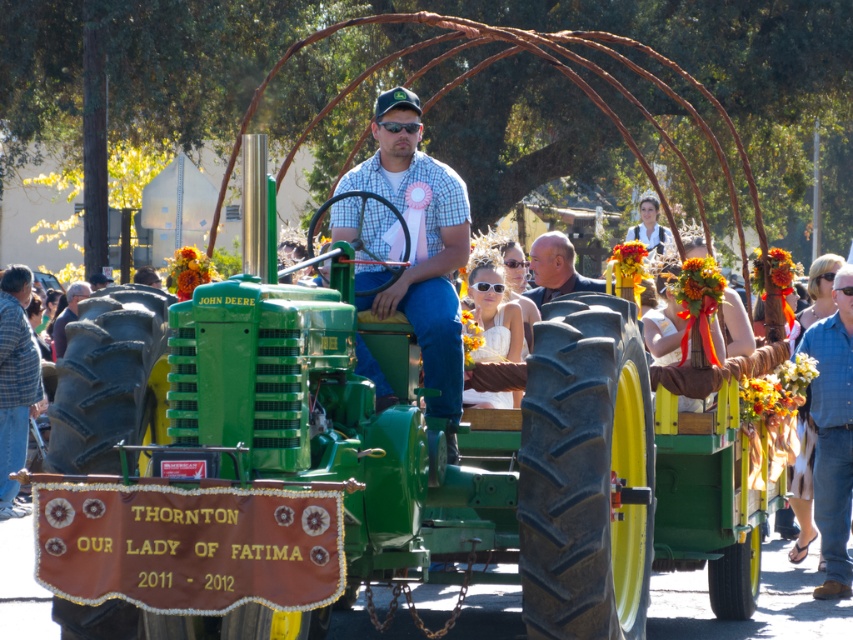
You are standing at the position of point (x=537, y=253) and want to walk to the green John Deere tractor at the center of the image. Which direction should you move relative to point (x=363, y=307)?

You should move towards point (x=363, y=307) because it is in front of point (x=537, y=253), so moving towards it will lead you closer to the tractor.

You are a tailor who needs to determine which leather jacket to alter first. The smooth brown leather jacket at center and the dark brown leather jacket at lower left are both in need of adjustments. Based on their positions in the image, which jacket is wider?

The smooth brown leather jacket at center might be wider than dark brown leather jacket at lower left according to the description.

You are a photographer at the event and want to capture both the smooth brown leather jacket at center and the dark brown leather jacket at lower left in a single shot. Which jacket should you position closer to the left side of the frame to ensure both are visible?

You should position the dark brown leather jacket at lower left closer to the left side of the frame since it is already to the left of the smooth brown leather jacket at center.